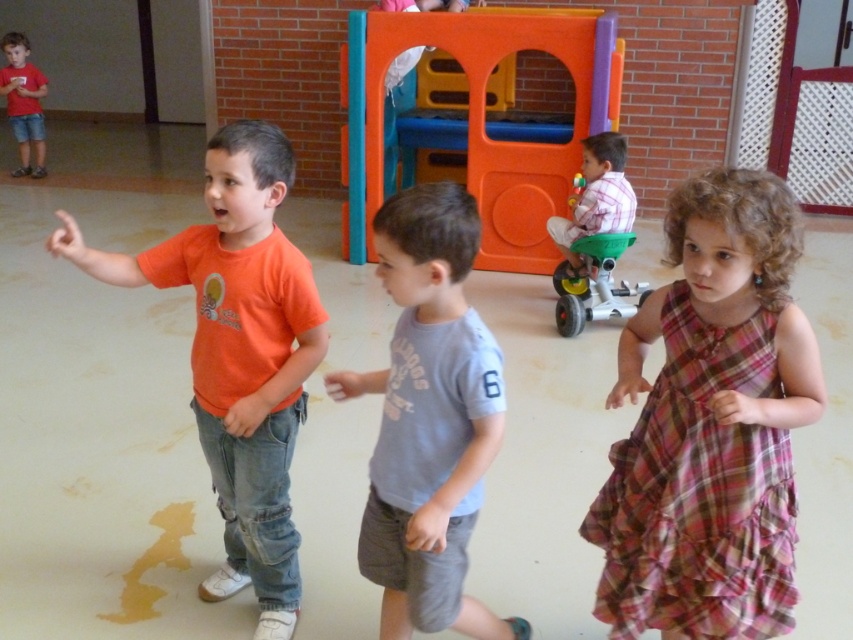
What object is located at the coordinates point (711, 424)?

The plaid fabric dress at center is located at point (711, 424).